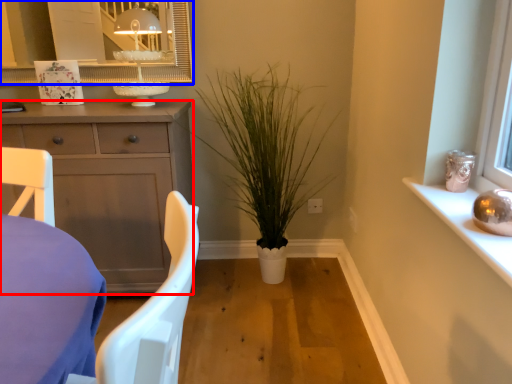
Question: Which object appears closest to the camera in this image, cabinetry (highlighted by a red box) or mirror (highlighted by a blue box)?

Choices:
 (A) cabinetry
 (B) mirror

Answer: (A)